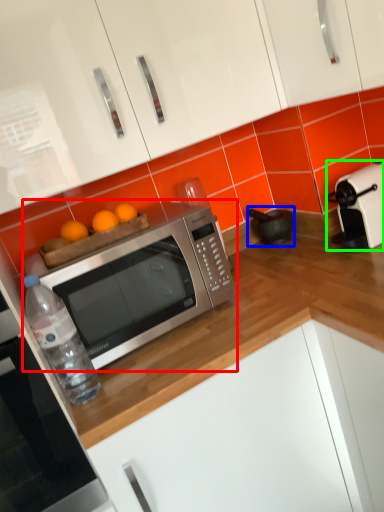
Question: Which object is positioned farthest from microwave oven (highlighted by a red box)? Select from appliance (highlighted by a blue box) and toaster (highlighted by a green box).

Choices:
 (A) appliance
 (B) toaster

Answer: (A)